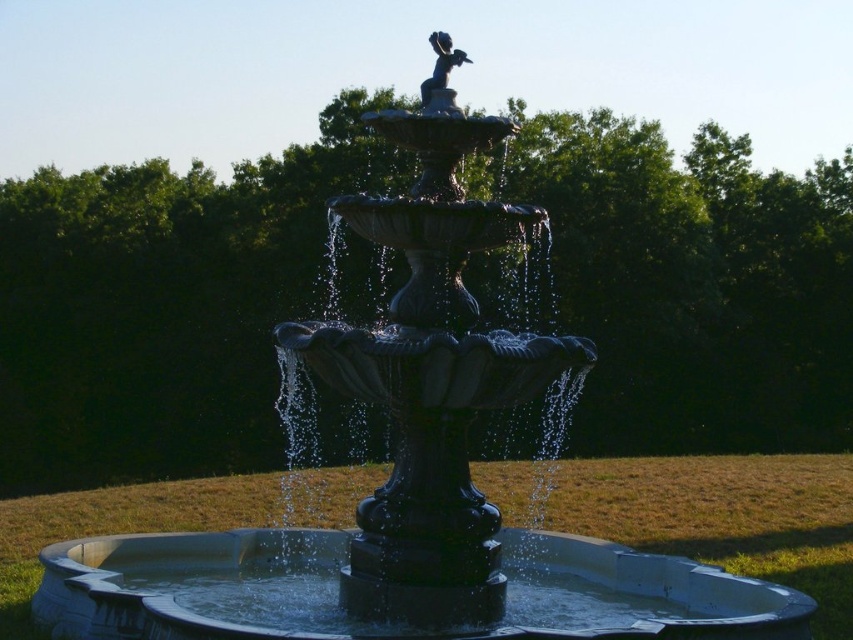
You are a maintenance worker checking the fountain. You need to clean the glossy concrete basin at center without getting the polished bronze statue at upper center wet. Is this possible?

Yes, since the glossy concrete basin at center is positioned under the polished bronze statue at upper center, you can clean the basin without affecting the statue.

You are a maintenance worker needing to clean the polished bronze statue at upper center and the glossy concrete basin at center. You have a 3 meter long pole. Can you reach the statue from the basin with the pole?

The distance between the glossy concrete basin at center and the polished bronze statue at upper center is 3.22 meters. Since the pole is only 3 meters long, it is 22 centimeters too short to reach the statue from the basin.

You are standing in front of the fountain and want to take a photo. You notice two points marked on the fountain, one at point coordinates point (190, 614) and the other at point coordinates point (436, 67). Which point will appear larger in your photo?

Point (190, 614) is closer to the camera than point (436, 67), so it will appear larger in the photo.